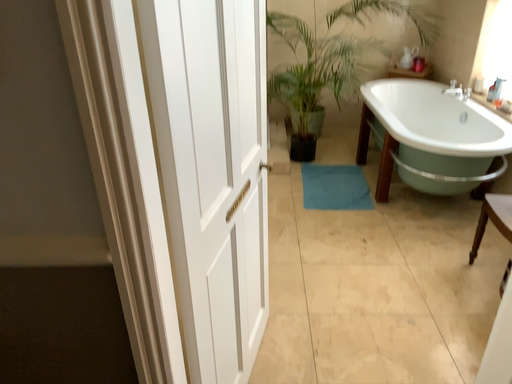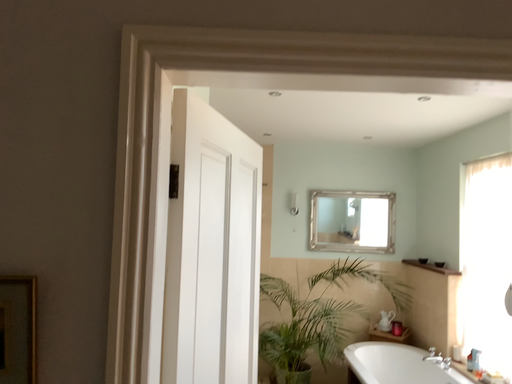
Question: How did the camera likely rotate when shooting the video?

Choices:
 (A) rotated upward
 (B) rotated downward

Answer: (A)